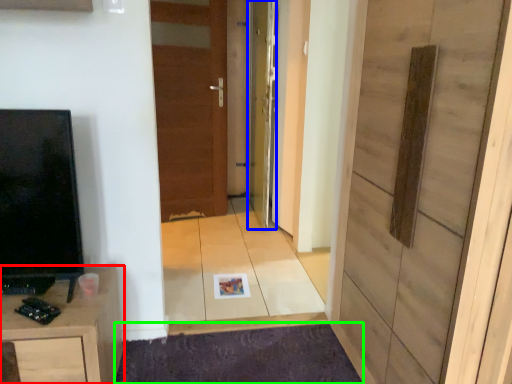
Question: Estimate the real-world distances between objects in this image. Which object is farther from cabinetry (highlighted by a red box), door (highlighted by a blue box) or doormat (highlighted by a green box)?

Choices:
 (A) door
 (B) doormat

Answer: (A)